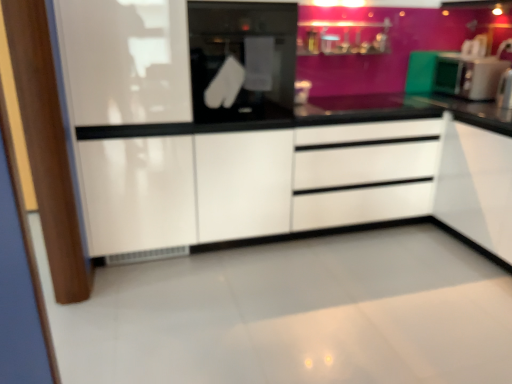
What is the approximate width of white glossy drawer at center?

It is 23.86 inches.

This screenshot has height=384, width=512. What do you see at coordinates (365, 173) in the screenshot? I see `white glossy drawer at center` at bounding box center [365, 173].

Describe the element at coordinates (242, 60) in the screenshot. I see `black glass oven at center` at that location.

Identify the location of black glass oven at center. (242, 60).

Locate an element on the screen. This screenshot has width=512, height=384. green matte microwave at right is located at coordinates (468, 76).

Identify the location of kitchen appliance lying behind the white glossy drawer at center. This screenshot has height=384, width=512. (468, 76).

Considering the relative sizes of white glossy drawer at center and green matte microwave at right in the image provided, is white glossy drawer at center wider than green matte microwave at right?

Indeed, white glossy drawer at center has a greater width compared to green matte microwave at right.

Is point (406, 152) in front of point (501, 63)?

That is True.

Is white glossy cabinet at center surrounding green matte microwave at right?

No, green matte microwave at right is located outside of white glossy cabinet at center.

Considering the relative sizes of white glossy cabinet at center and green matte microwave at right in the image provided, is white glossy cabinet at center bigger than green matte microwave at right?

Indeed, white glossy cabinet at center has a larger size compared to green matte microwave at right.

From a real-world perspective, is white glossy cabinet at center physically above green matte microwave at right?

Incorrect, from a real-world perspective, white glossy cabinet at center is lower than green matte microwave at right.

Does white glossy cabinet at center lie in front of green matte microwave at right?

Yes, white glossy cabinet at center is closer to the camera.

Could you tell me if green matte microwave at right is facing black glass oven at center?

Yes, green matte microwave at right is aimed at black glass oven at center.

How many degrees apart are the facing directions of green matte microwave at right and black glass oven at center?

There is a 90.7-degree angle between the facing directions of green matte microwave at right and black glass oven at center.

Is green matte microwave at right further to the viewer compared to black glass oven at center?

Yes, the depth of green matte microwave at right is greater than that of black glass oven at center.

Based on the photo, is green matte microwave at right positioned with its back to white glossy drawer at center?

No.

Considering the positions of objects green matte microwave at right and white glossy drawer at center in the image provided, who is more to the right, green matte microwave at right or white glossy drawer at center?

From the viewer's perspective, green matte microwave at right appears more on the right side.

From a real-world perspective, is green matte microwave at right positioned above or below white glossy drawer at center?

From a real-world perspective, green matte microwave at right is physically above white glossy drawer at center.

Is green matte microwave at right in contact with white glossy drawer at center?

green matte microwave at right is not next to white glossy drawer at center, and they're not touching.

In terms of size, does green matte microwave at right appear bigger or smaller than white glossy cabinet at center?

In the image, green matte microwave at right appears to be smaller than white glossy cabinet at center.

Based on the photo, from a real-world perspective, is green matte microwave at right physically located above or below white glossy cabinet at center?

In terms of real-world spatial position, green matte microwave at right is above white glossy cabinet at center.

From the image's perspective, who appears lower, green matte microwave at right or white glossy cabinet at center?

white glossy cabinet at center, from the image's perspective.

In the image, is white glossy drawer at center on the left side or the right side of black glass oven at center?

In the image, white glossy drawer at center appears on the right side of black glass oven at center.

From the image's perspective, which is below, white glossy drawer at center or black glass oven at center?

white glossy drawer at center.

Find the location of a particular element. Image resolution: width=512 pixels, height=384 pixels. drawer below the black glass oven at center (from a real-world perspective) is located at coordinates (365, 173).

Could black glass oven at center be considered to be inside white glossy drawer at center?

No.

Is black glass oven at center oriented towards green matte microwave at right?

No, black glass oven at center is not aimed at green matte microwave at right.

You are a GUI agent. You are given a task and a screenshot of the screen. Output one action in this format:
    pyautogui.click(x=<x>, y=<y>)
    Task: Click on the home appliance below the green matte microwave at right (from the image's perspective)
    
    Given the screenshot: What is the action you would take?
    pyautogui.click(x=242, y=60)

Is black glass oven at center bigger than green matte microwave at right?

Yes.

From a real-world perspective, is black glass oven at center positioned over green matte microwave at right based on gravity?

Yes, from a real-world perspective, black glass oven at center is over green matte microwave at right

The image size is (512, 384). I want to click on drawer in front of the green matte microwave at right, so click(365, 173).

You are a GUI agent. You are given a task and a screenshot of the screen. Output one action in this format:
    pyautogui.click(x=<x>, y=<y>)
    Task: Click on the kitchen appliance that appears on the right of white glossy cabinet at center
    This screenshot has width=512, height=384.
    Given the screenshot: What is the action you would take?
    pyautogui.click(x=468, y=76)

Considering their positions, is white glossy drawer at center positioned further to white glossy cabinet at center than green matte microwave at right?

green matte microwave at right is further to white glossy cabinet at center.

In the scene shown: Estimate the real-world distances between objects in this image. Which object is closer to white glossy drawer at center, black glass oven at center or white glossy cabinet at center?

white glossy cabinet at center.

Estimate the real-world distances between objects in this image. Which object is further from black glass oven at center, green matte microwave at right or white glossy cabinet at center?

green matte microwave at right is positioned further to the anchor black glass oven at center.

Considering their positions, is green matte microwave at right positioned closer to black glass oven at center than white glossy drawer at center?

white glossy drawer at center.

Based on their spatial positions, is white glossy cabinet at center or white glossy drawer at center closer to black glass oven at center?

Among the two, white glossy cabinet at center is located nearer to black glass oven at center.

Based on their spatial positions, is white glossy drawer at center or white glossy cabinet at center closer to black glass oven at center?

The object closer to black glass oven at center is white glossy cabinet at center.

Considering their positions, is green matte microwave at right positioned further to white glossy cabinet at center than white glossy drawer at center?

green matte microwave at right is positioned further to the anchor white glossy cabinet at center.

Considering their positions, is green matte microwave at right positioned further to white glossy cabinet at center than black glass oven at center?

green matte microwave at right.

Locate an element on the screen. The width and height of the screenshot is (512, 384). home appliance between white glossy cabinet at center and green matte microwave at right in the horizontal direction is located at coordinates (242, 60).

This screenshot has width=512, height=384. I want to click on drawer between white glossy cabinet at center and green matte microwave at right in the horizontal direction, so click(365, 173).

The width and height of the screenshot is (512, 384). I want to click on home appliance between white glossy cabinet at center and white glossy drawer at center from left to right, so click(x=242, y=60).

At what (x,y) coordinates should I click in order to perform the action: click on drawer between black glass oven at center and green matte microwave at right from left to right. Please return your answer as a coordinate pair (x, y). Looking at the image, I should click on (365, 173).